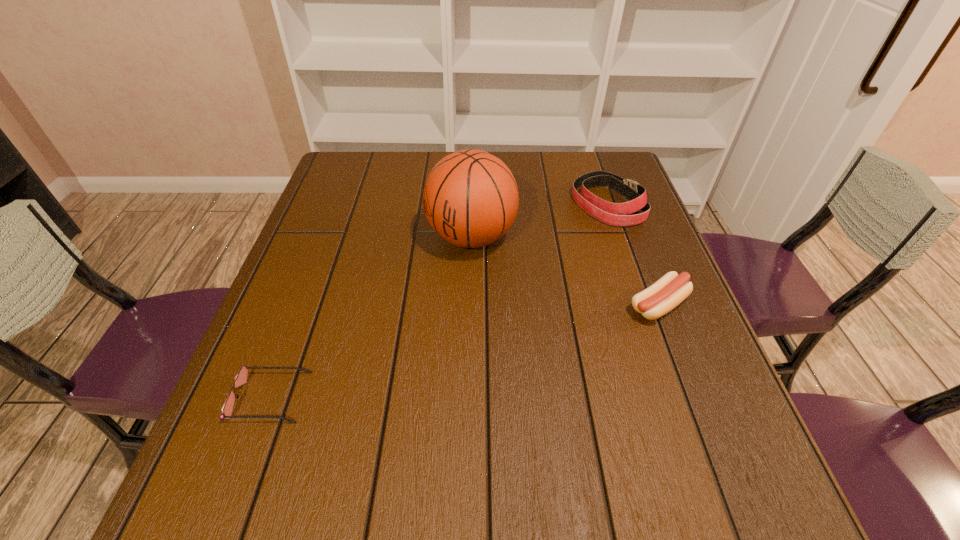
Where is `free spot between the dog collar and the third tallest object`? free spot between the dog collar and the third tallest object is located at coordinates (633, 255).

Identify the location of object that is the second closest to the second nearest object. The image size is (960, 540). [470, 199].

Where is `object that is the closest to the shortest object`? object that is the closest to the shortest object is located at coordinates (470, 199).

Find the location of a particular element. vacant space that satisfies the following two spatial constraints: 1. on the front side of the basketball; 2. on the right side of the second nearest object is located at coordinates (470, 306).

Identify the location of vacant space that satisfies the following two spatial constraints: 1. on the front side of the tallest object; 2. on the right side of the third farthest object. (470, 306).

The height and width of the screenshot is (540, 960). Find the location of `vacant area that satisfies the following two spatial constraints: 1. on the front side of the second object from left to right; 2. on the bridge of the sunglasses`. vacant area that satisfies the following two spatial constraints: 1. on the front side of the second object from left to right; 2. on the bridge of the sunglasses is located at coordinates (468, 397).